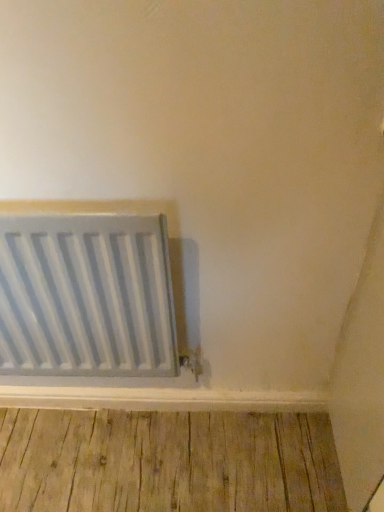
This screenshot has width=384, height=512. Describe the element at coordinates (86, 296) in the screenshot. I see `metallic silver radiator at lower left` at that location.

Measure the distance between metallic silver radiator at lower left and camera.

The depth of metallic silver radiator at lower left is 31.08 inches.

This screenshot has width=384, height=512. I want to click on metallic silver radiator at lower left, so click(86, 296).

The height and width of the screenshot is (512, 384). Describe the element at coordinates (167, 462) in the screenshot. I see `natural wood floor at bottom` at that location.

What is the approximate width of natural wood floor at bottom?

It is 12.99 inches.

At what (x,y) coordinates should I click in order to perform the action: click on natural wood floor at bottom. Please return your answer as a coordinate pair (x, y). The image size is (384, 512). Looking at the image, I should click on (167, 462).

At what (x,y) coordinates should I click in order to perform the action: click on metallic silver radiator at lower left. Please return your answer as a coordinate pair (x, y). Looking at the image, I should click on (86, 296).

Which is more to the right, metallic silver radiator at lower left or natural wood floor at bottom?

Positioned to the right is natural wood floor at bottom.

Is metallic silver radiator at lower left further to camera compared to natural wood floor at bottom?

That is False.

Which point is more distant from viewer, (19, 276) or (54, 457)?

The point (54, 457) is more distant.

From the image's perspective, is metallic silver radiator at lower left below natural wood floor at bottom?

No, from the image's perspective, metallic silver radiator at lower left is not below natural wood floor at bottom.

From a real-world perspective, is metallic silver radiator at lower left over natural wood floor at bottom?

Yes.

In the scene shown: Is metallic silver radiator at lower left wider than natural wood floor at bottom?

No, metallic silver radiator at lower left is not wider than natural wood floor at bottom.

In terms of height, does metallic silver radiator at lower left look taller or shorter compared to natural wood floor at bottom?

In the image, metallic silver radiator at lower left appears to be taller than natural wood floor at bottom.

Looking at the image, does metallic silver radiator at lower left seem bigger or smaller compared to natural wood floor at bottom?

Clearly, metallic silver radiator at lower left is larger in size than natural wood floor at bottom.

Would you say natural wood floor at bottom is part of metallic silver radiator at lower left's contents?

No, natural wood floor at bottom is not surrounded by metallic silver radiator at lower left.

Does metallic silver radiator at lower left touch natural wood floor at bottom?

No.

Could you tell me if metallic silver radiator at lower left is turned towards natural wood floor at bottom?

No, metallic silver radiator at lower left is not aimed at natural wood floor at bottom.

What's the angular difference between metallic silver radiator at lower left and natural wood floor at bottom's facing directions?

The angle between the facing direction of metallic silver radiator at lower left and the facing direction of natural wood floor at bottom is 179 degrees.

This screenshot has height=512, width=384. I want to click on hardwood below the metallic silver radiator at lower left (from a real-world perspective), so click(x=167, y=462).

Consider the image. Is natural wood floor at bottom to the left of metallic silver radiator at lower left from the viewer's perspective?

Incorrect, natural wood floor at bottom is not on the left side of metallic silver radiator at lower left.

Does natural wood floor at bottom lie in front of metallic silver radiator at lower left?

No.

Which is behind, point (213, 431) or point (125, 313)?

Positioned behind is point (213, 431).

From the image's perspective, which one is positioned higher, natural wood floor at bottom or metallic silver radiator at lower left?

metallic silver radiator at lower left, from the image's perspective.

From a real-world perspective, who is located lower, natural wood floor at bottom or metallic silver radiator at lower left?

natural wood floor at bottom, from a real-world perspective.

Based on the photo, is natural wood floor at bottom thinner than metallic silver radiator at lower left?

In fact, natural wood floor at bottom might be wider than metallic silver radiator at lower left.

Is natural wood floor at bottom taller or shorter than metallic silver radiator at lower left?

natural wood floor at bottom is shorter than metallic silver radiator at lower left.

Which of these two, natural wood floor at bottom or metallic silver radiator at lower left, is bigger?

With larger size is metallic silver radiator at lower left.

In the scene shown: Is natural wood floor at bottom positioned beyond the bounds of metallic silver radiator at lower left?

natural wood floor at bottom lies outside metallic silver radiator at lower left's area.

Does natural wood floor at bottom touch metallic silver radiator at lower left?

No, natural wood floor at bottom is not making contact with metallic silver radiator at lower left.

Based on the photo, is natural wood floor at bottom turned away from metallic silver radiator at lower left?

No.

How much distance is there between natural wood floor at bottom and metallic silver radiator at lower left?

natural wood floor at bottom and metallic silver radiator at lower left are 17.81 inches apart from each other.

This screenshot has width=384, height=512. In order to click on hardwood located behind the metallic silver radiator at lower left in this screenshot , I will do `click(167, 462)`.

At what (x,y) coordinates should I click in order to perform the action: click on hardwood that is on the right side of metallic silver radiator at lower left. Please return your answer as a coordinate pair (x, y). The height and width of the screenshot is (512, 384). Looking at the image, I should click on (167, 462).

Find the location of a particular element. This screenshot has height=512, width=384. hardwood below the metallic silver radiator at lower left (from a real-world perspective) is located at coordinates (167, 462).